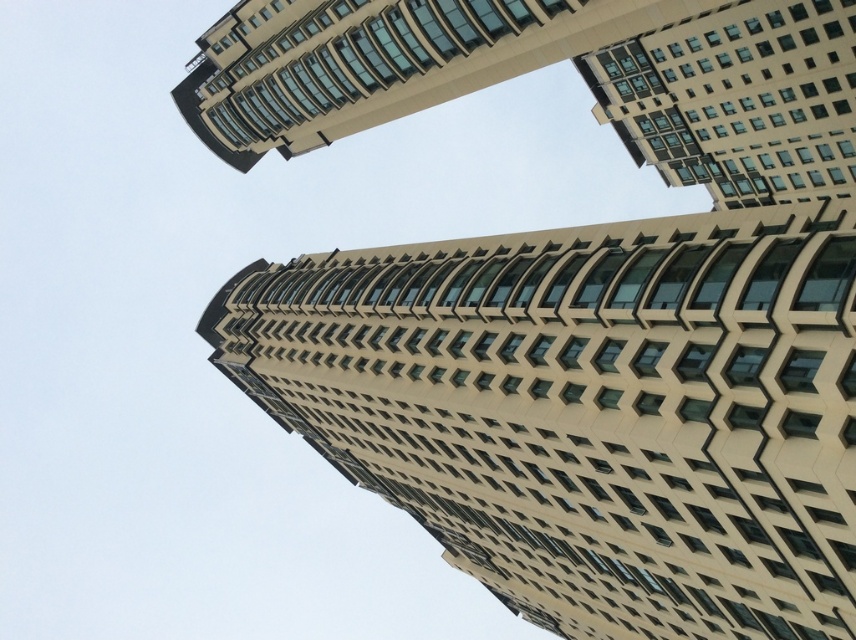
Question: Among these objects, which one is farthest from the camera?

Choices:
 (A) beige glass building at upper center
 (B) beige concrete building at center

Answer: (A)

Question: Is beige concrete building at center to the left of beige glass building at upper center from the viewer's perspective?

Choices:
 (A) no
 (B) yes

Answer: (A)

Question: Which point is farther to the camera?

Choices:
 (A) beige concrete building at center
 (B) beige glass building at upper center

Answer: (B)

Question: Can you confirm if beige concrete building at center is positioned above beige glass building at upper center?

Choices:
 (A) no
 (B) yes

Answer: (A)

Question: Which object appears closest to the camera in this image?

Choices:
 (A) beige concrete building at center
 (B) beige glass building at upper center

Answer: (A)

Question: Can you confirm if beige concrete building at center is smaller than beige glass building at upper center?

Choices:
 (A) no
 (B) yes

Answer: (B)